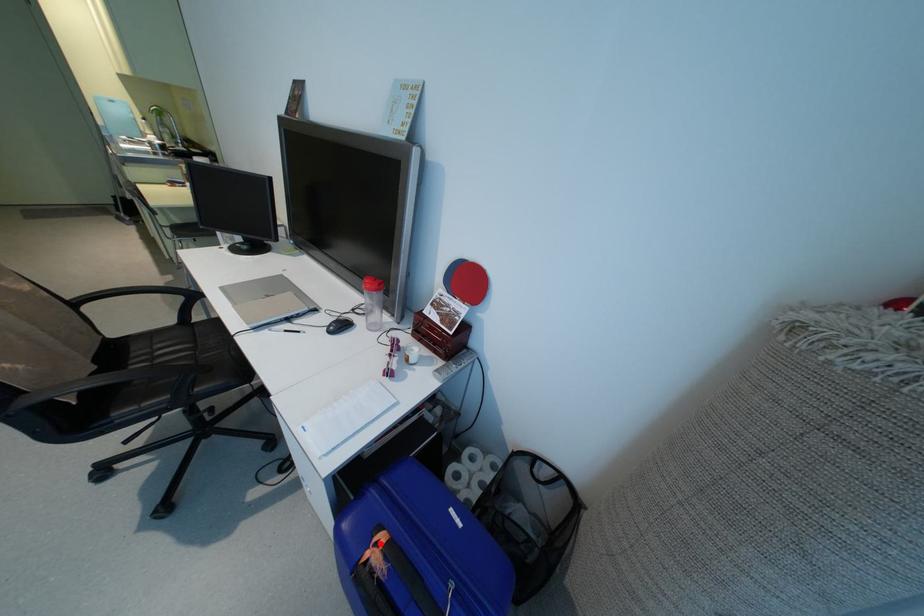
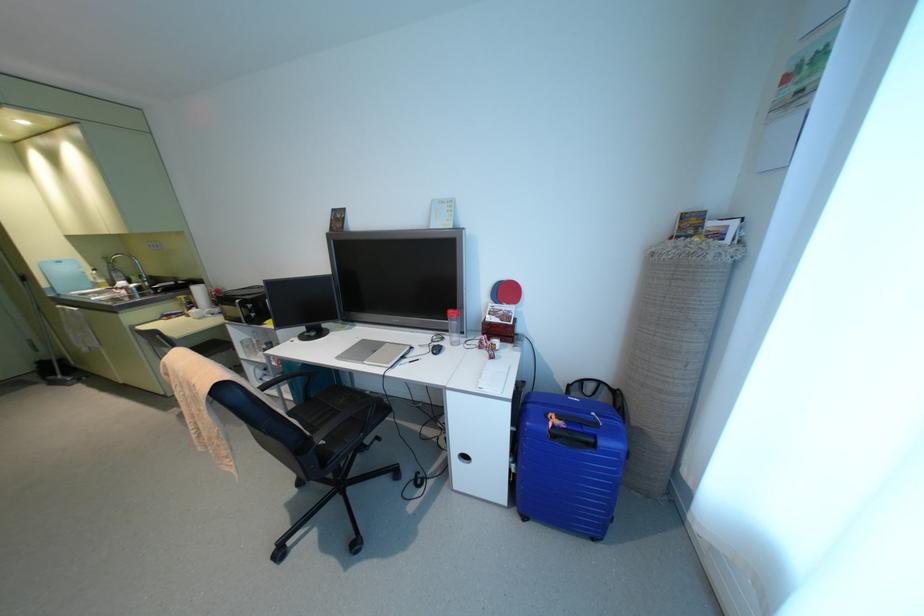
Question: I am providing you with two images of the same scene from different viewpoints. A red point is marked on the first image. At the location where the point appears in image 1, is it still visible in image 2?

Choices:
 (A) Yes
 (B) No

Answer: (A)